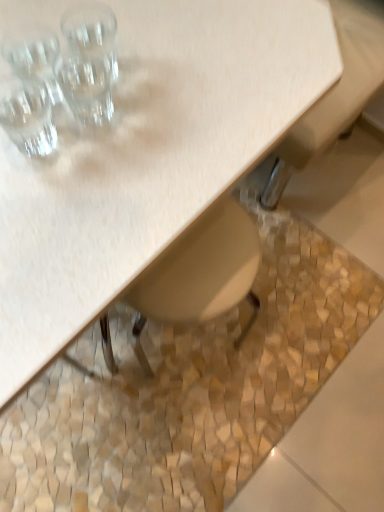
Question: Is matte wood table at upper left situated inside clear glass shot glass at upper left, the 3th shot glass from the top, or outside?

Choices:
 (A) outside
 (B) inside

Answer: (A)

Question: Looking at the image, does matte wood table at upper left seem bigger or smaller compared to clear glass shot glass at upper left, the 3th shot glass from the top?

Choices:
 (A) small
 (B) big

Answer: (B)

Question: Based on their relative distances, which object is farther from the matte wood table at upper left?

Choices:
 (A) transparent glass at upper left, the 2th shot glass when ordered from top to bottom
 (B) clear glass shot glass at upper left, which appears as the 1th shot glass when ordered from the bottom
 (C) beige mosaic tile at lower center
 (D) transparent glass at upper left, the third shot glass ordered from the bottom

Answer: (C)

Question: Which is farther from the beige mosaic tile at lower center?

Choices:
 (A) transparent glass at upper left, the 2th shot glass when ordered from top to bottom
 (B) matte wood table at upper left
 (C) clear glass shot glass at upper left, the 3th shot glass from the top
 (D) transparent glass at upper left, which is the 1th shot glass in top-to-bottom order

Answer: (D)